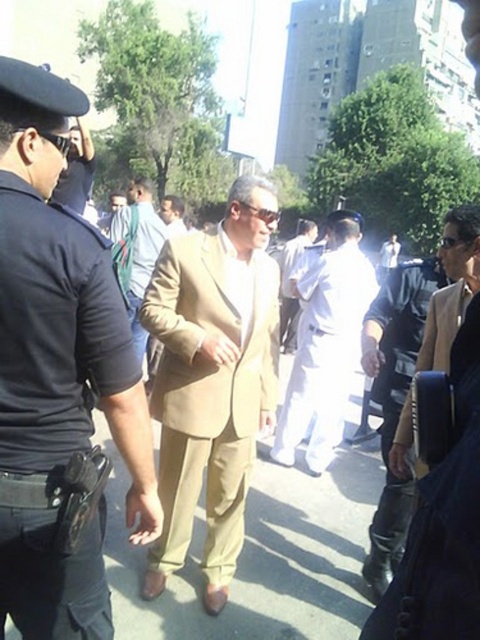
Can you confirm if tan fabric suit at center is taller than light brown suit at center?

Yes.

Which is more to the right, tan fabric suit at center or light brown suit at center?

From the viewer's perspective, tan fabric suit at center appears more on the right side.

Find the location of a particular element. The image size is (480, 640). tan fabric suit at center is located at coordinates (59, 378).

At what (x,y) coordinates should I click in order to perform the action: click on tan fabric suit at center. Please return your answer as a coordinate pair (x, y). This screenshot has width=480, height=640. Looking at the image, I should click on (59, 378).

Which of these two, matte khaki suit at center or beige fabric suit at center, stands taller?

matte khaki suit at center

Is matte khaki suit at center to the right of beige fabric suit at center from the viewer's perspective?

Indeed, matte khaki suit at center is positioned on the right side of beige fabric suit at center.

Does point (235, 214) come in front of point (135, 195)?

Yes, it is.

Where is `matte khaki suit at center`? The image size is (480, 640). matte khaki suit at center is located at coordinates (213, 380).

Does white cotton shirt at center have a smaller size compared to light brown suit at center?

Actually, white cotton shirt at center might be larger than light brown suit at center.

Does white cotton shirt at center appear over light brown suit at center?

No.

Who is more forward, (x=342, y=218) or (x=179, y=209)?

Positioned in front is point (x=342, y=218).

The height and width of the screenshot is (640, 480). Find the location of `white cotton shirt at center`. white cotton shirt at center is located at coordinates (324, 348).